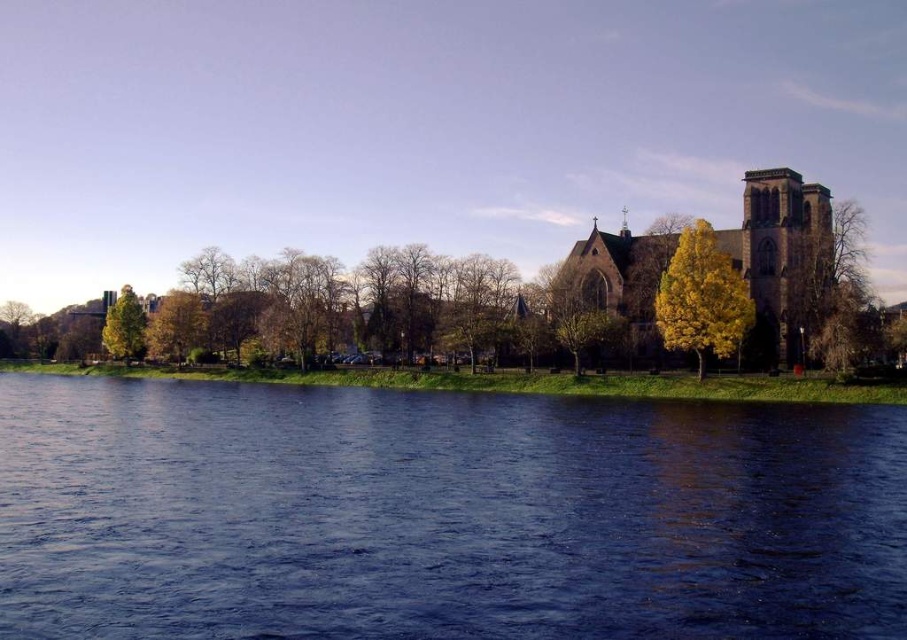
Question: Which of these objects is positioned closest to the golden yellow leaves at left?

Choices:
 (A) brown stone church at center
 (B) green leafy tree at right
 (C) green leafy tree at left

Answer: (C)

Question: Which object appears closest to the camera in this image?

Choices:
 (A) golden yellow leaves at left
 (B) green leafy tree at right
 (C) green leafy tree at left
 (D) brown stone church at center

Answer: (B)

Question: Does brown stone church at center have a larger size compared to golden yellow leaves at left?

Choices:
 (A) yes
 (B) no

Answer: (A)

Question: Can you confirm if yellow leafy tree at center-right is wider than golden yellow leaves at left?

Choices:
 (A) no
 (B) yes

Answer: (B)

Question: Which of these objects is positioned closest to the blue water at lower center?

Choices:
 (A) golden yellow leaves at left
 (B) yellow leafy tree at center-right

Answer: (B)

Question: Can you confirm if yellow leafy tree at center-right is thinner than golden yellow leaves at left?

Choices:
 (A) no
 (B) yes

Answer: (A)